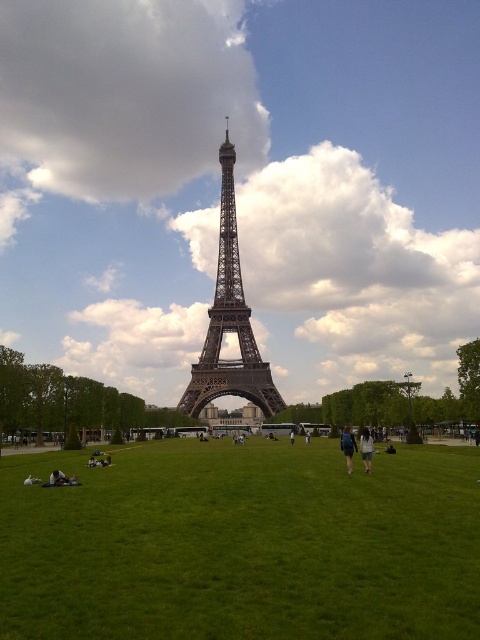
You are a photographer standing at the Champ de Mars in Paris, France. You want to capture a photo that includes both the metallic gray eiffel tower at center and the dark blue jeans at center. Which object should you zoom in on to make both subjects appear balanced in the frame?

To balance both the metallic gray eiffel tower at center and the dark blue jeans at center in the frame, you should zoom in on the metallic gray eiffel tower at center since it is larger and will require adjustment to match the size of the dark blue jeans at center.

You are standing at the Champ de Mars and see the matte metal eiffel tower at center and the dark blue jeans at center. Which object is positioned to the left from your perspective?

The matte metal eiffel tower at center is to the left of the dark blue jeans at center.

You are standing at the Champ de Mars looking towards the Eiffel Tower. There are two points marked in the scene. One is at coordinates point (227, 227) and the other at point (360, 449). Which point is closer to you?

Point (227, 227) is further to the camera than point (360, 449). Therefore, point (360, 449) is closer to you.